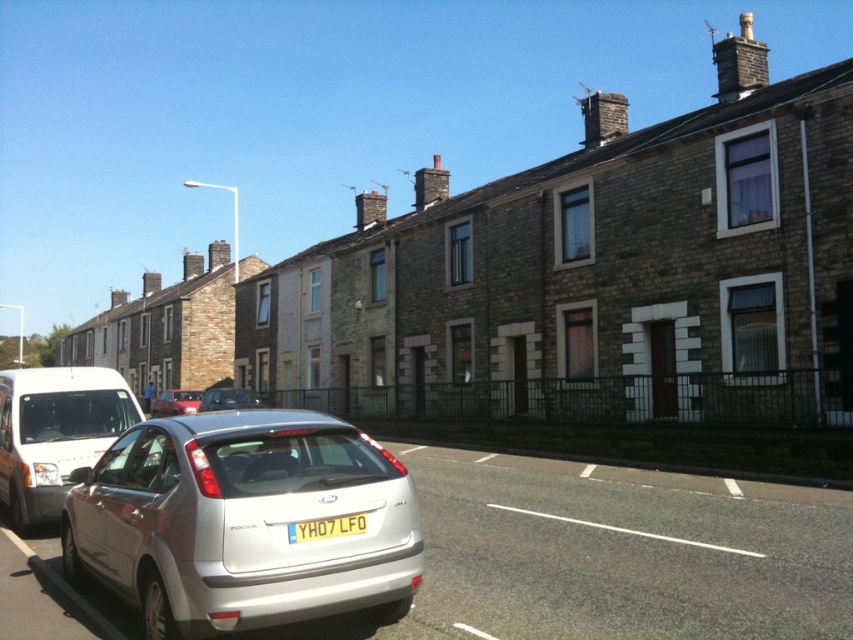
Question: Can you confirm if silver metallic hatchback at left is positioned to the left of metallic silver sedan at center?

Choices:
 (A) no
 (B) yes

Answer: (A)

Question: Does silver metallic hatchback at lower left have a smaller size compared to metallic red car at lower left?

Choices:
 (A) no
 (B) yes

Answer: (B)

Question: Considering the relative positions of silver metallic hatchback at left and yellow matte license plate at center in the image provided, where is silver metallic hatchback at left located with respect to yellow matte license plate at center?

Choices:
 (A) left
 (B) right

Answer: (A)

Question: Which point is closer to the camera taking this photo?

Choices:
 (A) (202, 410)
 (B) (13, 376)

Answer: (B)

Question: Which of the following is the farthest from the observer?

Choices:
 (A) silver metallic hatchback at left
 (B) silver metallic hatchback at lower left
 (C) metallic silver sedan at center
 (D) metallic red car at lower left

Answer: (D)

Question: Which point is farther from the camera taking this photo?

Choices:
 (A) (196, 556)
 (B) (200, 390)
 (C) (321, 524)
 (D) (125, 422)

Answer: (B)